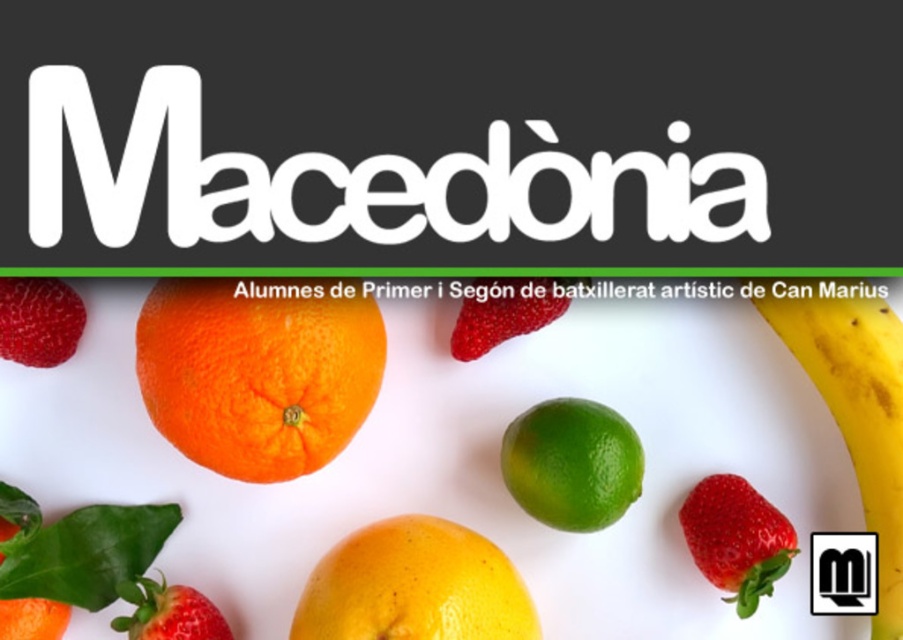
You are preparing a fruit platter and need to know which fruit is bigger. Which one is larger between the yellow matte grapefruit at center and the ripe red strawberry at lower left?

The yellow matte grapefruit at center is larger in size than the ripe red strawberry at lower left.

You are arranging fruits for a fruit platter and notice the yellow matte grapefruit at center and the ripe red strawberry at lower left. Which fruit is located to the right of the other?

The yellow matte grapefruit at center is positioned on the right side of the ripe red strawberry at lower left.